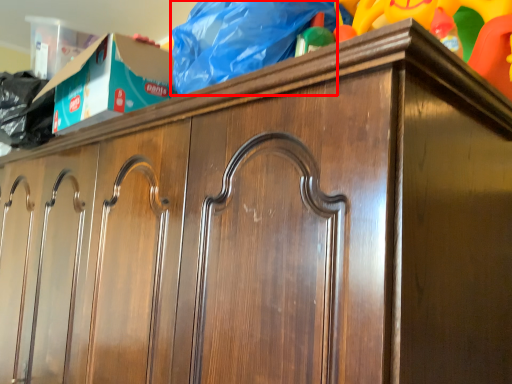
Question: From the image's perspective, where is material (annotated by the red box) located in relation to toy in the image?

Choices:
 (A) below
 (B) above

Answer: (A)